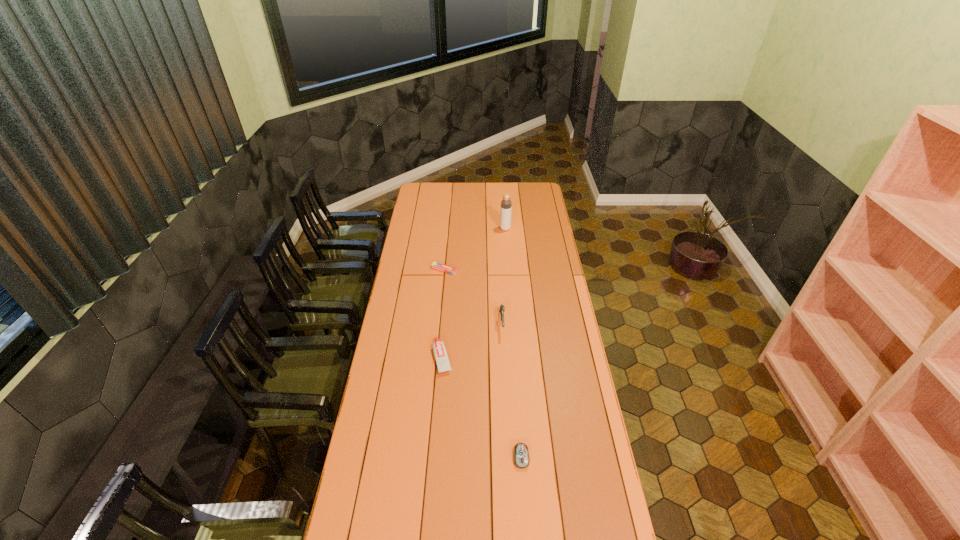
The height and width of the screenshot is (540, 960). In order to click on vacant space that's between the shorter toothpaste and the taller toothpaste in this screenshot , I will do `click(444, 314)`.

Where is `empty space that is in between the fourth farthest object and the computer mouse`? This screenshot has width=960, height=540. empty space that is in between the fourth farthest object and the computer mouse is located at coordinates (482, 407).

Image resolution: width=960 pixels, height=540 pixels. Find the location of `free space between the tallest object and the nearest object`. free space between the tallest object and the nearest object is located at coordinates (514, 343).

Where is `vacant point located between the tallest object and the nearer toothpaste`? This screenshot has width=960, height=540. vacant point located between the tallest object and the nearer toothpaste is located at coordinates (474, 293).

The height and width of the screenshot is (540, 960). Find the location of `unoccupied area between the nearer toothpaste and the bottle`. unoccupied area between the nearer toothpaste and the bottle is located at coordinates (474, 293).

Image resolution: width=960 pixels, height=540 pixels. Find the location of `free area in between the nearer toothpaste and the bottle`. free area in between the nearer toothpaste and the bottle is located at coordinates (474, 293).

What are the coordinates of `vacant space that is in between the bottle and the fourth shortest object` in the screenshot? It's located at (504, 275).

Where is `object that is the third closest one to the farthest object`? The width and height of the screenshot is (960, 540). object that is the third closest one to the farthest object is located at coordinates (440, 353).

In order to click on object that is the fourth nearest to the tallest object in this screenshot , I will do `click(521, 454)`.